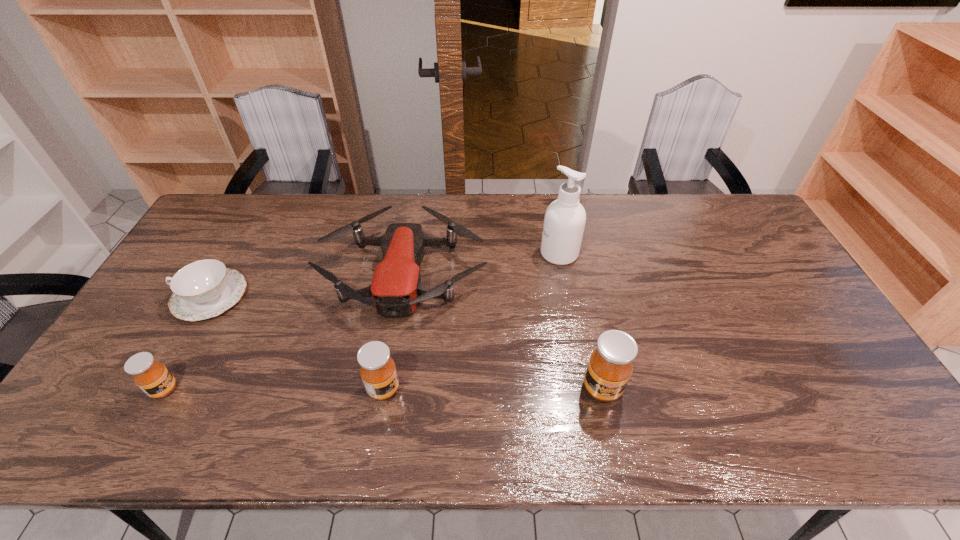
Identify the location of the leftmost honey. This screenshot has width=960, height=540. (153, 378).

Where is `the second honey from right to left`? The image size is (960, 540). the second honey from right to left is located at coordinates (378, 371).

The width and height of the screenshot is (960, 540). Identify the location of the second shortest honey. (378, 371).

Identify the location of the second tallest object. (609, 368).

Where is `the rightmost honey`? The image size is (960, 540). the rightmost honey is located at coordinates (609, 368).

In order to click on the tallest object in this screenshot , I will do point(565,218).

The height and width of the screenshot is (540, 960). Find the location of `the shortest object`. the shortest object is located at coordinates (203, 289).

Find the location of `drone`. drone is located at coordinates (396, 288).

Image resolution: width=960 pixels, height=540 pixels. Identify the location of free spot located 0.080m on the front-facing side of the leftmost honey. (210, 389).

Identify the location of vacant space located on the front-facing side of the second honey from right to left. (453, 389).